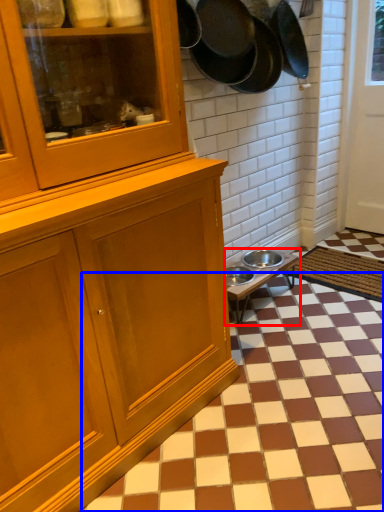
Question: Which of the following is the farthest to the observer, table (highlighted by a red box) or tile (highlighted by a blue box)?

Choices:
 (A) table
 (B) tile

Answer: (A)